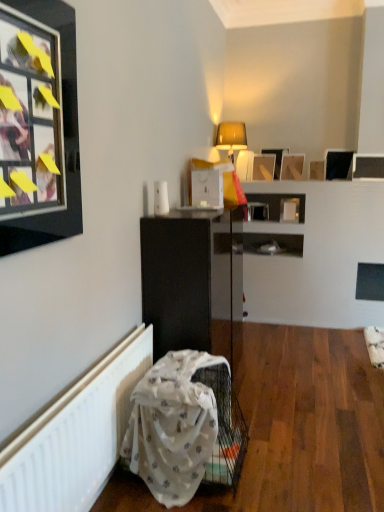
Question: Considering the positions of point (319, 179) and point (360, 168), is point (319, 179) closer or farther from the camera than point (360, 168)?

Choices:
 (A) farther
 (B) closer

Answer: (A)

Question: Looking at the image, does wooden picture frame at upper center, which is the 3th picture frame in right-to-left order, seem bigger or smaller compared to matte black picture frame at upper right, which appears as the 6th picture frame when viewed from the back?

Choices:
 (A) small
 (B) big

Answer: (A)

Question: Considering the real-world distances, which object is closest to the matte black picture frame at upper right, the 2th picture frame when ordered from front to back?

Choices:
 (A) matte black picture frame at upper left, marked as the first picture frame in a front-to-back arrangement
 (B) matte yellow table lamp at upper center
 (C) wooden picture frame at upper center, the fourth picture frame positioned from the left
 (D) black glossy shelf at lower center
 (E) wooden picture frame at upper center, positioned as the 2th picture frame in left-to-right order

Answer: (C)

Question: Considering the real-world distances, which object is closest to the matte black picture frame at upper right, which appears as the 6th picture frame when viewed from the back?

Choices:
 (A) wooden picture frame at upper center, which is the 6th picture frame in right-to-left order
 (B) white textured radiator at lower left
 (C) matte yellow table lamp at upper center
 (D) black glossy picture frame at upper right, the sixth picture frame in the left-to-right sequence
 (E) white fabric swivel chair at lower left

Answer: (D)